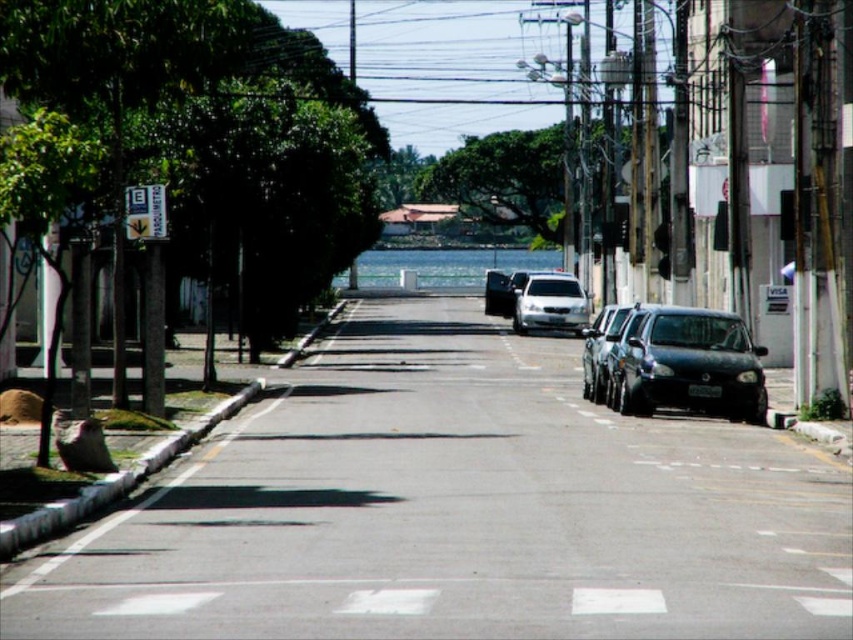
You are a pedestrian standing at the crosswalk in the middle of the road. You see the shiny black sedan at center right and the shiny silver sedan at center. Which car is closer to the parked cars on the right side of the street?

The shiny black sedan at center right is closer to the parked cars on the right side of the street because it is positioned to the right of the shiny silver sedan at center, which places it nearer to the parked cars.

You are standing at the intersection and want to cross the road to the signpost on the left. There is a shiny black sedan at right parked at point [688,364]. Can you safely cross the road without passing near the shiny black sedan at right?

The shiny black sedan at right is located at point [688,364]. Since the sedan is parked on the right side of the street, you can safely cross to the signpost on the left without passing near it.

You are a delivery person standing at the shiny black sedan at right. You need to cross the road to reach the signpost on the left side. The road is 15 meters wide. Can you safely cross the road without needing to walk into the road?

The distance between the shiny black sedan at right and the signpost is 20.77 meters. Since the road is 15 meters wide, you can safely cross the road without needing to walk into the road by staying on the sidewalk on the right side until you reach the signpost.